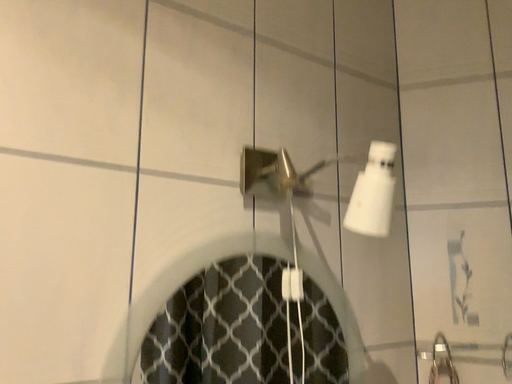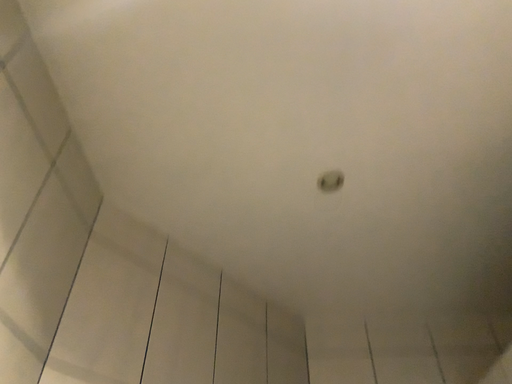
Question: How did the camera likely rotate when shooting the video?

Choices:
 (A) rotated upward
 (B) rotated downward

Answer: (A)